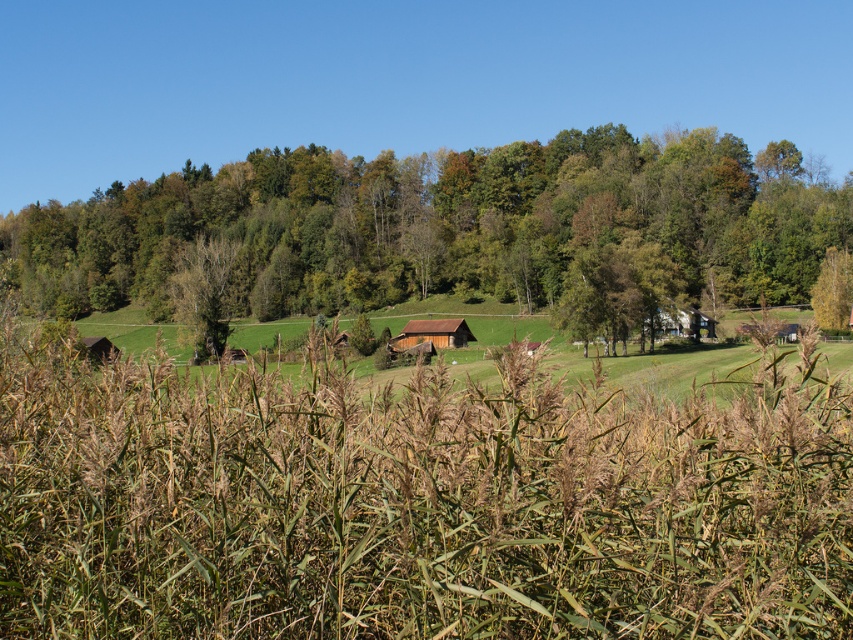
Question: Which point is farther to the camera?

Choices:
 (A) brown wooden hut at center
 (B) white wooden hut at center-right
 (C) green leafy tree at center
 (D) green leafy tree at right

Answer: (A)

Question: Is green matte tree at center below green leafy tree at right?

Choices:
 (A) no
 (B) yes

Answer: (A)

Question: Among these objects, which one is farthest from the camera?

Choices:
 (A) green matte tree at center
 (B) green leafy tree at center
 (C) green leafy tree at right
 (D) brown wooden hut at center

Answer: (A)

Question: Does green leafy tree at right have a larger size compared to white wooden hut at center-right?

Choices:
 (A) no
 (B) yes

Answer: (B)

Question: Which point appears closest to the camera in this image?

Choices:
 (A) (209, 268)
 (B) (814, 296)
 (C) (262, 296)
 (D) (450, 317)

Answer: (B)

Question: Can you confirm if green leafy tree at center is positioned below white wooden hut at center-right?

Choices:
 (A) yes
 (B) no

Answer: (B)